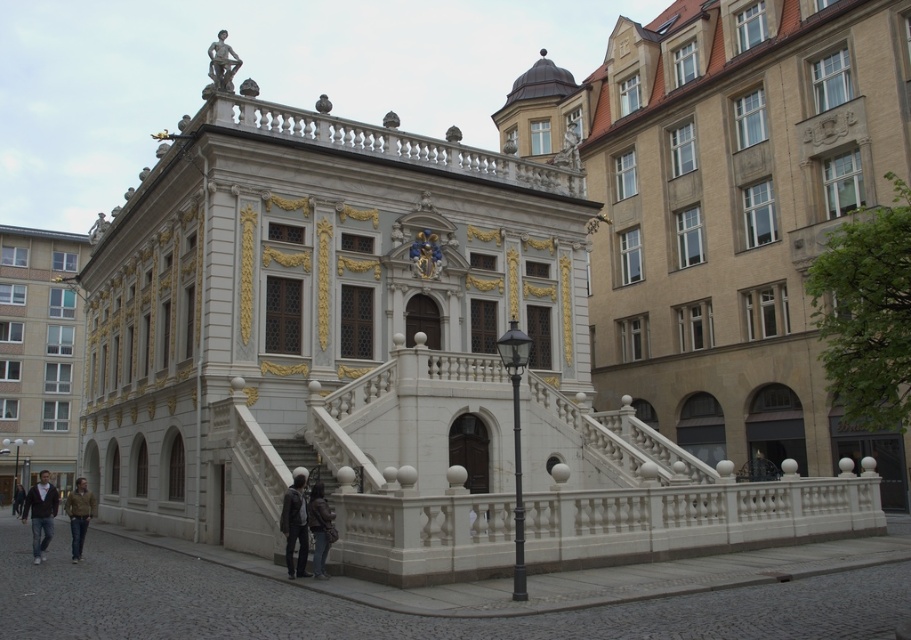
You are standing at the entrance of the grand building and see the dark brown leather jacket at lower center and the white marble stairs at center. Which object is closer to you?

The dark brown leather jacket at lower center is closer to you since it is in front of the white marble stairs at center.

You are standing in front of the grand ornate building and notice a dark brown leather jacket at lower center. Where exactly is the dark brown leather jacket positioned in relation to the building?

The dark brown leather jacket at lower center is located at point coordinates of 0.825 on the x axis and 0.352 on the y axis.

You are standing in front of the beige stone building at center and the dark brown leather jacket at lower center. Which object is positioned to the right side?

The beige stone building at center is to the right of the dark brown leather jacket at lower center.